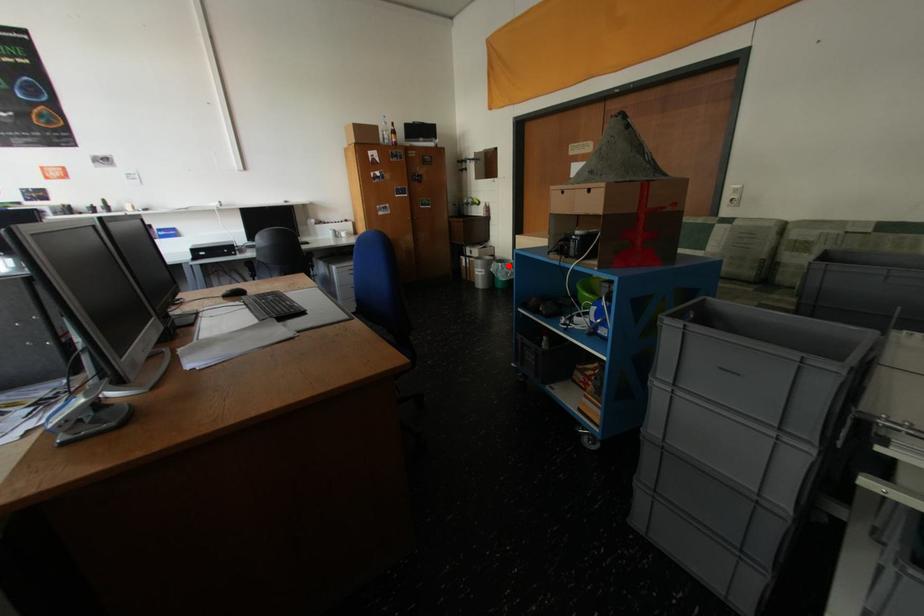
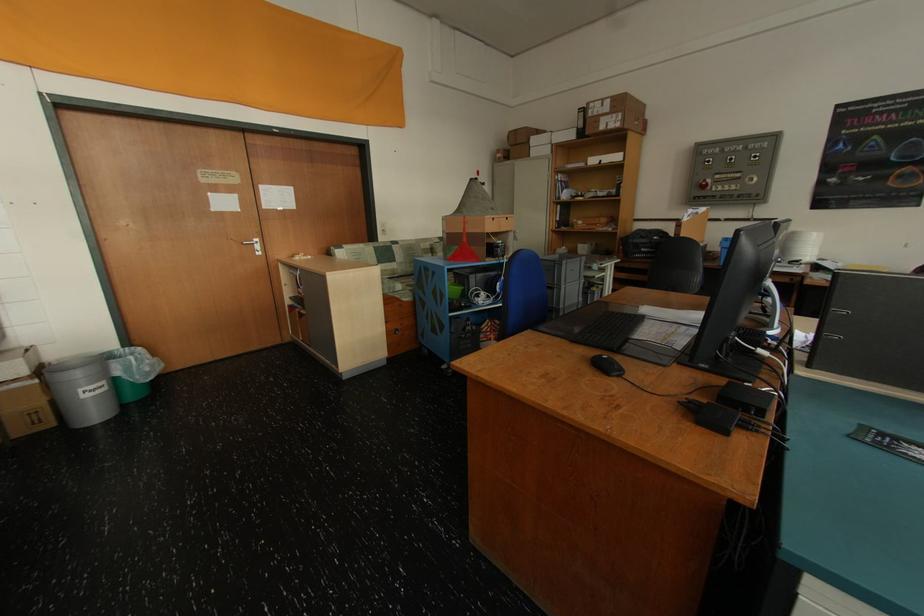
Question: I am providing you with two images of the same scene from different viewpoints. Image1 has a red point marked. In image2, the corresponding 3D location appears at what relative position? Reply with the corresponding letter.

Choices:
 (A) Closer
 (B) Farther

Answer: (B)